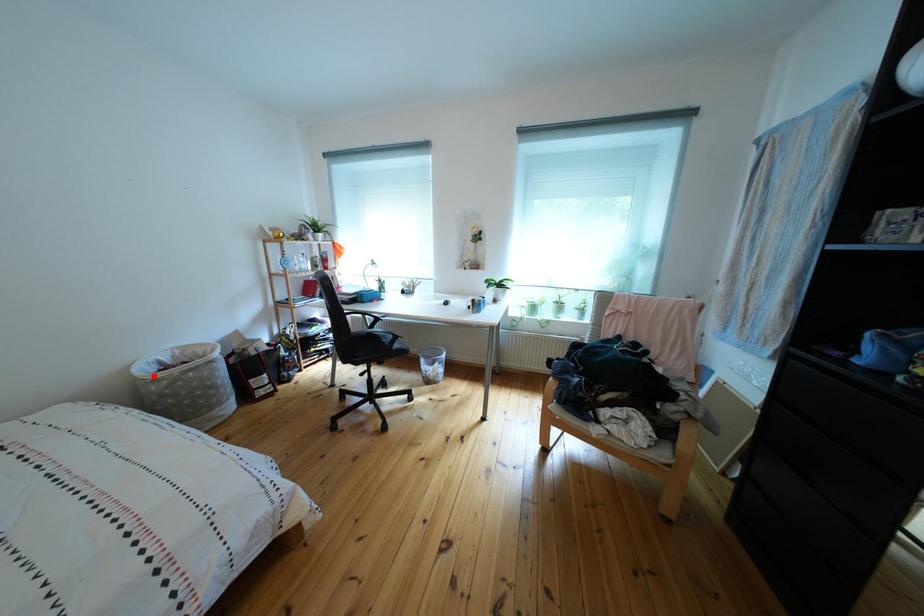
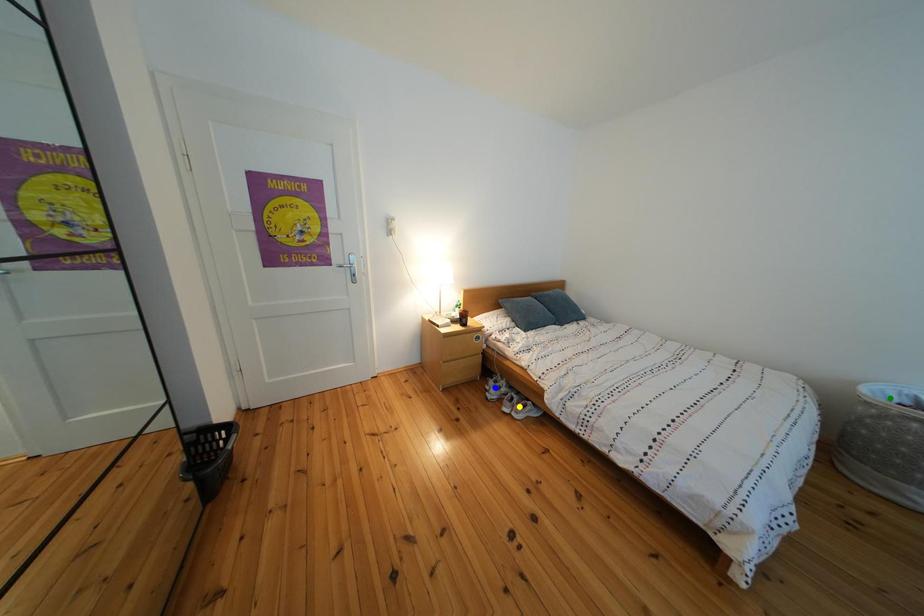
Question: I am providing you with two images of the same scene from different viewpoints. A red point is marked on the first image. You are given multiple points on the second image. Which mark in image 2 goes with the point in image 1?

Choices:
 (A) yellow point
 (B) blue point
 (C) green point

Answer: (C)